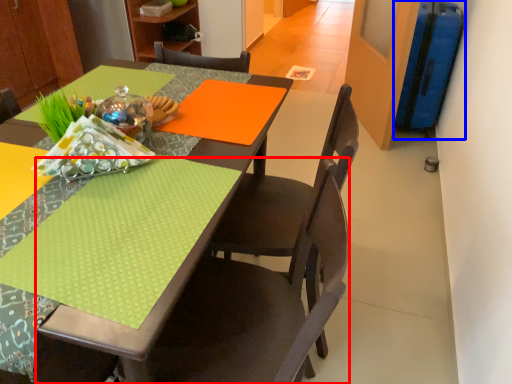
Question: Among these objects, which one is nearest to the camera, chair (highlighted by a red box) or luggage (highlighted by a blue box)?

Choices:
 (A) chair
 (B) luggage

Answer: (A)